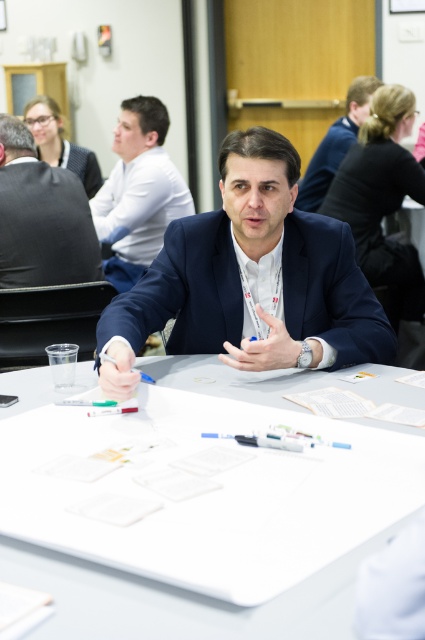
Between matte blue suit at center and matte black suit at upper center, which one has more height?

matte blue suit at center is taller.

Between point (125, 289) and point (337, 128), which one is positioned in front?

Point (125, 289)

You are a GUI agent. You are given a task and a screenshot of the screen. Output one action in this format:
    pyautogui.click(x=<x>, y=<y>)
    Task: Click on the matte blue suit at center
    
    Given the screenshot: What is the action you would take?
    pyautogui.click(x=138, y=193)

In the scene shown: Which is more to the left, blue suit at center or dark gray suit at upper left?

dark gray suit at upper left

Does blue suit at center have a smaller size compared to dark gray suit at upper left?

No.

This screenshot has height=640, width=425. Identify the location of blue suit at center. (251, 278).

Between blue suit at center and matte black suit at upper center, which one appears on the left side from the viewer's perspective?

Positioned to the left is blue suit at center.

In the scene shown: Between blue suit at center and matte black suit at upper center, which one appears on the right side from the viewer's perspective?

matte black suit at upper center is more to the right.

Where is `blue suit at center`? The width and height of the screenshot is (425, 640). blue suit at center is located at coordinates [x=251, y=278].

The image size is (425, 640). Identify the location of blue suit at center. (251, 278).